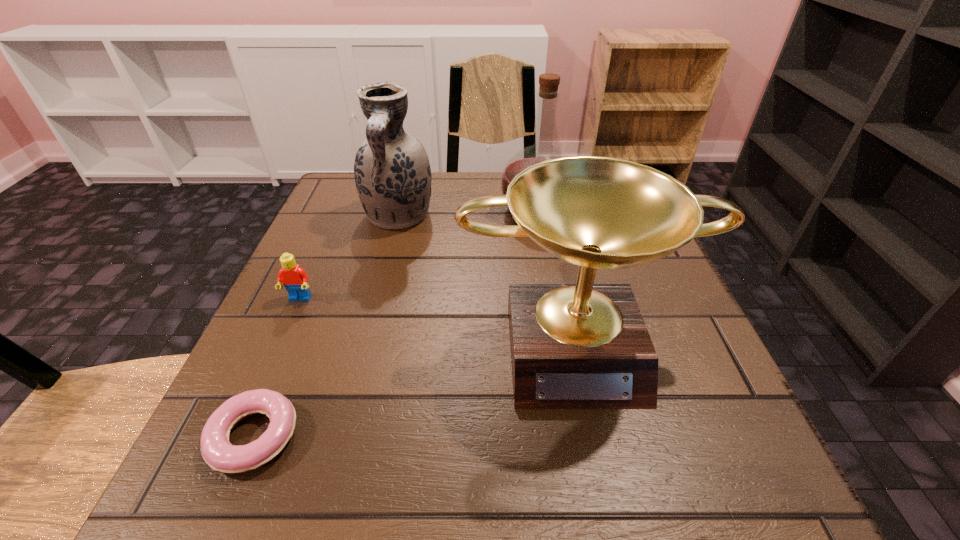
You are a GUI agent. You are given a task and a screenshot of the screen. Output one action in this format:
    pyautogui.click(x=<x>, y=<y>)
    Task: Click on the object at the far right corner
    
    Given the screenshot: What is the action you would take?
    pyautogui.click(x=548, y=94)

Locate an element on the screen. This screenshot has height=540, width=960. vacant space at the far edge is located at coordinates (429, 210).

The width and height of the screenshot is (960, 540). In order to click on free space at the near edge of the desktop in this screenshot , I will do `click(503, 516)`.

What are the coordinates of `vacant space at the left edge` in the screenshot? It's located at (365, 260).

You are a GUI agent. You are given a task and a screenshot of the screen. Output one action in this format:
    pyautogui.click(x=<x>, y=<y>)
    Task: Click on the vacant point at the right edge
    The height and width of the screenshot is (540, 960).
    Given the screenshot: What is the action you would take?
    pyautogui.click(x=702, y=362)

The image size is (960, 540). What are the coordinates of `unoccupied position between the second shortest object and the liquor` in the screenshot? It's located at (419, 254).

The image size is (960, 540). I want to click on vacant space in between the shortest object and the award, so click(415, 389).

Where is `free space between the award and the liquor`? Image resolution: width=960 pixels, height=540 pixels. free space between the award and the liquor is located at coordinates (556, 276).

At what (x,y) coordinates should I click in order to perform the action: click on empty space between the liquor and the second shortest object. Please return your answer as a coordinate pair (x, y). Looking at the image, I should click on (419, 254).

Identify the location of free space between the award and the doughnut. Image resolution: width=960 pixels, height=540 pixels. (415, 389).